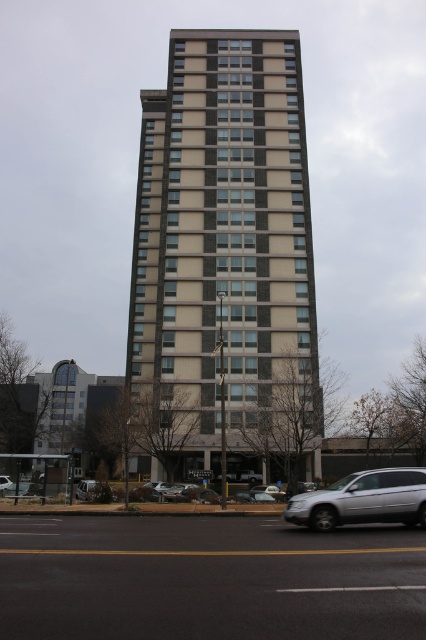
You are a pedestrian standing on the sidewalk in front of the residential building. You see two silver sedans on the street. Which one is closer to the building? The metallic silver sedan at lower center or the shiny silver sedan at center?

The metallic silver sedan at lower center is positioned on the left side of the shiny silver sedan at center, so the shiny silver sedan at center is closer to the building.

You are standing on the sidewalk in front of the residential building and want to cross the street to reach the other side. The silver metallic suv at lower right is approaching from your right. Given that the street is 50 feet wide, can you safely cross before the suv reaches you?

The silver metallic suv at lower right is 48.53 feet away from you. Since the street is 50 feet wide, you can safely cross before the suv reaches you as the distance between you and the suv is slightly less than the street width, giving you enough time to cross.